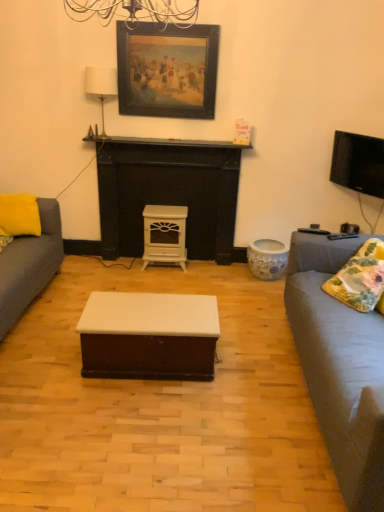
Question: Would you say floral fabric pillow at right, which is the 1th pillow in right-to-left order, is to the left or to the right of yellow fabric pillow at left, which is the 1th pillow in back-to-front order, in the picture?

Choices:
 (A) left
 (B) right

Answer: (B)

Question: Is floral fabric pillow at right, placed as the 2th pillow when sorted from back to front, bigger or smaller than yellow fabric pillow at left, which appears as the 1th pillow when viewed from the top?

Choices:
 (A) big
 (B) small

Answer: (B)

Question: Estimate the real-world distances between objects in this image. Which object is closer to the gray fabric couch at right?

Choices:
 (A) flat screen tv at upper right
 (B) white matte wood coffee table at center
 (C) white fabric lampshade at upper center
 (D) white glossy wood fireplace at center
 (E) black matte fireplace at center

Answer: (B)

Question: Which object is the closest to the flat screen tv at upper right?

Choices:
 (A) white glossy wood fireplace at center
 (B) wooden picture frame at upper center
 (C) floral fabric pillow at right, which ranks as the first pillow in bottom-to-top order
 (D) white glossy wood stove at center
 (E) yellow fabric pillow at left, which is the 1th pillow in back-to-front order

Answer: (C)